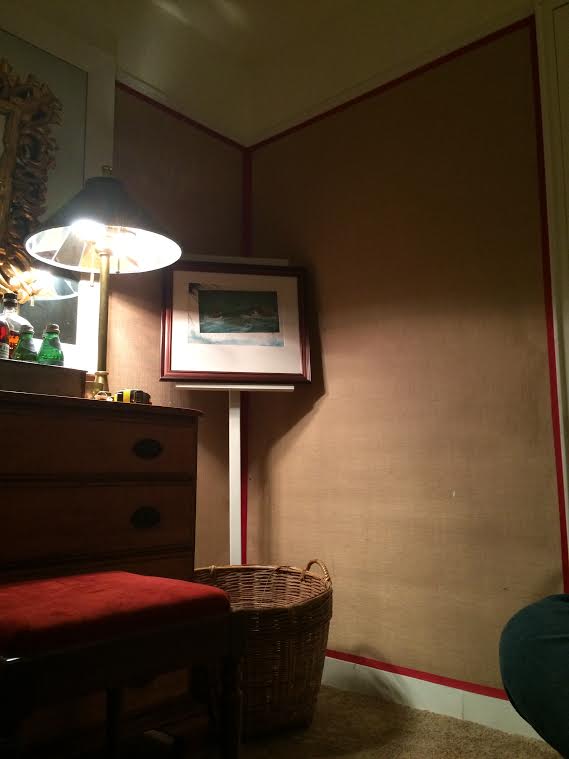
Locate an element on the screen. lamp shade is located at coordinates (135, 216).